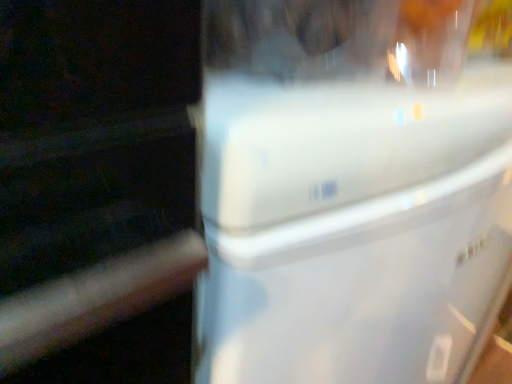
Image resolution: width=512 pixels, height=384 pixels. Describe the element at coordinates (354, 189) in the screenshot. I see `white glossy refrigerator at center` at that location.

Where is `white glossy refrigerator at center`? Image resolution: width=512 pixels, height=384 pixels. white glossy refrigerator at center is located at coordinates (354, 189).

Measure the distance between point (382, 178) and camera.

A distance of 10.75 inches exists between point (382, 178) and camera.

Identify the location of white glossy refrigerator at center. Image resolution: width=512 pixels, height=384 pixels. (354, 189).